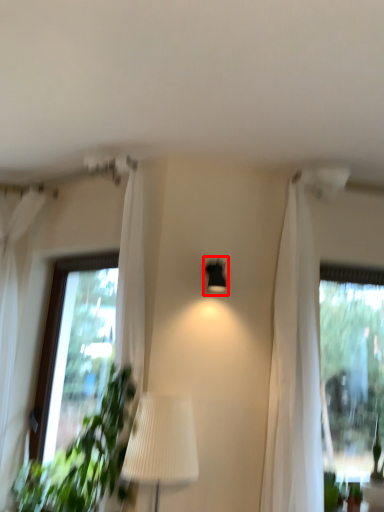
Question: Observing the image, what is the correct spatial positioning of lamp (annotated by the red box) in reference to curtain?

Choices:
 (A) right
 (B) left

Answer: (A)